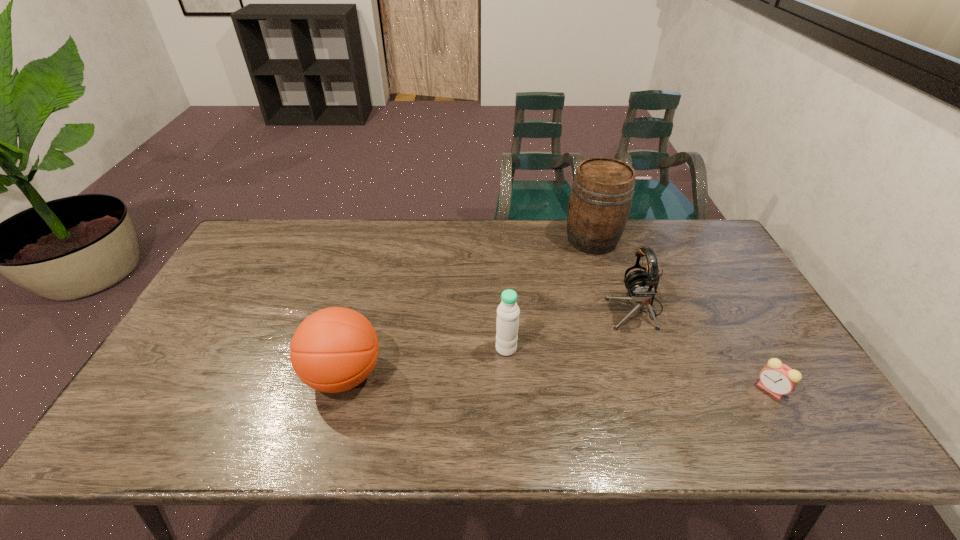
Locate an element on the screen. Image resolution: width=960 pixels, height=540 pixels. blank space that satisfies the following two spatial constraints: 1. on the side of the second farthest object near the bung hole; 2. on the left side of the farthest object is located at coordinates (613, 309).

Find the location of a particular element. The height and width of the screenshot is (540, 960). free location that satisfies the following two spatial constraints: 1. on the side of the tallest object near the bung hole; 2. on the front side of the basketball is located at coordinates (634, 375).

You are a GUI agent. You are given a task and a screenshot of the screen. Output one action in this format:
    pyautogui.click(x=<x>, y=<y>)
    Task: Click on the free spot that satisfies the following two spatial constraints: 1. on the side of the tallest object near the bung hole; 2. on the left side of the second farthest object
    
    Given the screenshot: What is the action you would take?
    pyautogui.click(x=613, y=309)